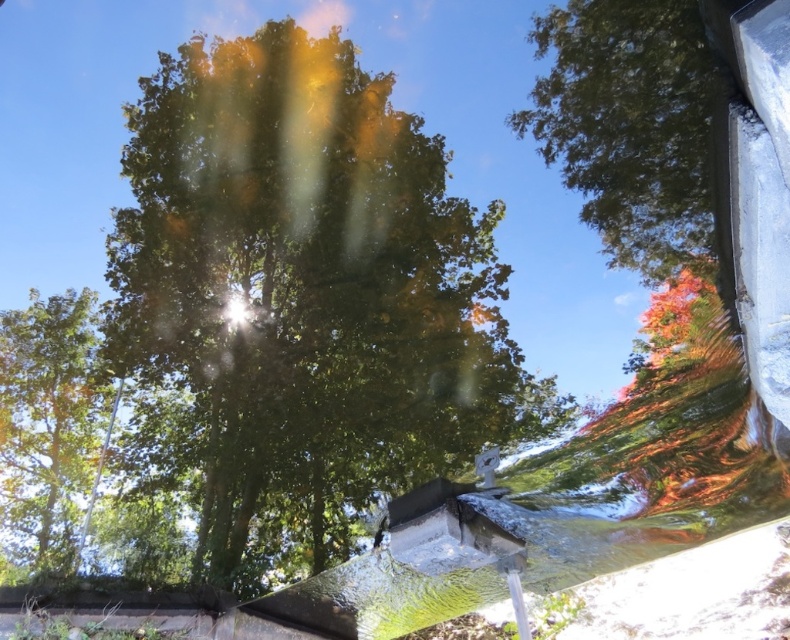
Does green leafy tree at center lie in front of green leafy tree at left?

Yes, green leafy tree at center is in front of green leafy tree at left.

Can you confirm if green leafy tree at center is bigger than green leafy tree at left?

Yes.

Is point (198, 403) farther from viewer compared to point (17, 554)?

Yes, point (198, 403) is behind point (17, 554).

Identify the location of green leafy tree at center. The width and height of the screenshot is (790, 640). (299, 304).

Does green leafy tree at center have a greater height compared to green leafy tree at upper right?

Indeed, green leafy tree at center has a greater height compared to green leafy tree at upper right.

Who is more distant from viewer, (354, 291) or (600, 152)?

Point (354, 291)

Find the location of a particular element. green leafy tree at center is located at coordinates (299, 304).

Between green leafy tree at upper right and green leafy tree at left, which one appears on the right side from the viewer's perspective?

Positioned to the right is green leafy tree at upper right.

What do you see at coordinates (636, 131) in the screenshot?
I see `green leafy tree at upper right` at bounding box center [636, 131].

Is point (721, 131) positioned in front of point (76, 324)?

Yes.

This screenshot has height=640, width=790. What are the coordinates of `green leafy tree at upper right` in the screenshot? It's located at (636, 131).